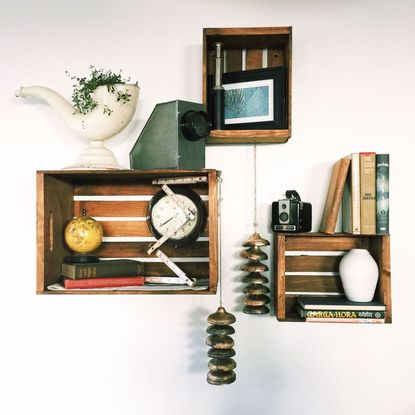
Find the location of a particular element. book is located at coordinates (354, 216).